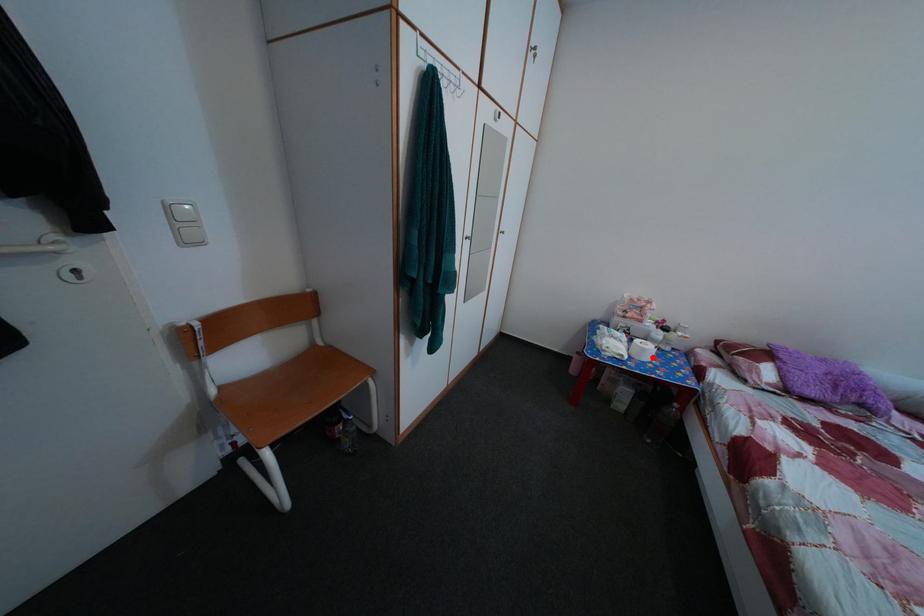
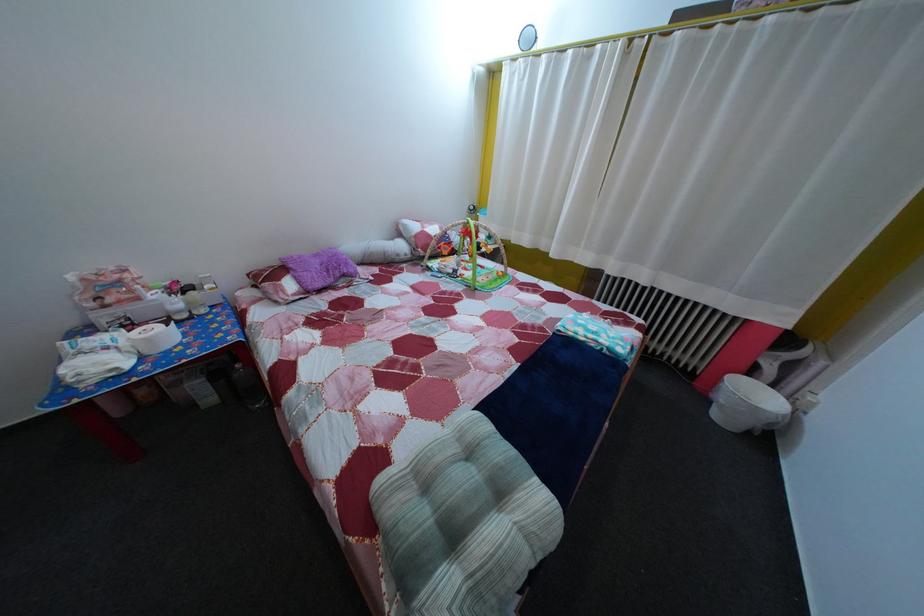
Question: I am providing you with two images of the same scene from different viewpoints. A red point is shown in image1. For the corresponding object point in image2, is it positioned nearer or farther from the camera?

Choices:
 (A) Nearer
 (B) Farther

Answer: (B)